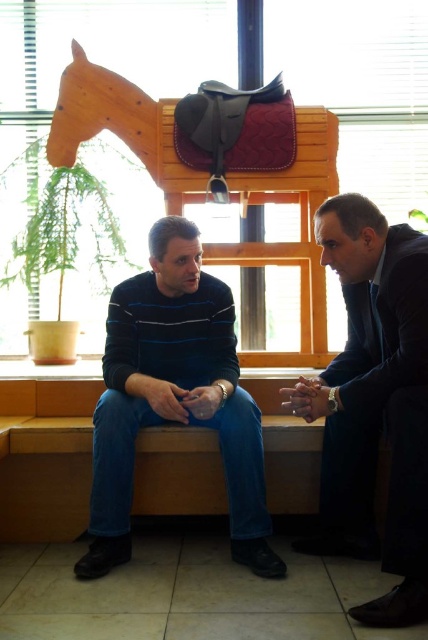
Question: Which of the following is the farthest from the observer?

Choices:
 (A) (403, 605)
 (B) (71, 163)
 (C) (106, 420)

Answer: (B)

Question: Is dark blue suit at center thinner than dark blue striped sweater at center?

Choices:
 (A) no
 (B) yes

Answer: (B)

Question: Observing the image, what is the correct spatial positioning of dark blue suit at center in reference to wooden horse at upper center?

Choices:
 (A) left
 (B) right

Answer: (B)

Question: Does dark blue striped sweater at center appear on the left side of wooden horse at upper center?

Choices:
 (A) no
 (B) yes

Answer: (B)

Question: Which point is farther to the camera?

Choices:
 (A) (297, 198)
 (B) (98, 440)
 (C) (341, 416)

Answer: (A)

Question: Which point is closer to the camera?

Choices:
 (A) (329, 248)
 (B) (309, 177)
 (C) (189, 340)

Answer: (A)